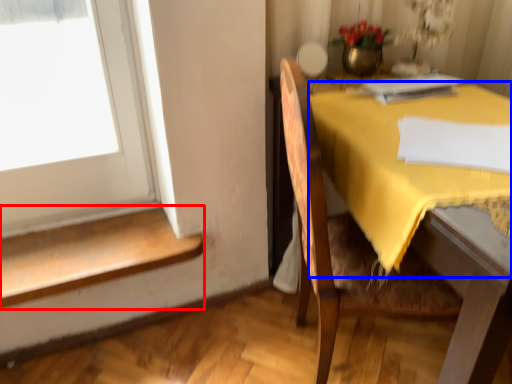
Question: Among these objects, which one is farthest to the camera, stairwell (highlighted by a red box) or tablecloth (highlighted by a blue box)?

Choices:
 (A) stairwell
 (B) tablecloth

Answer: (A)